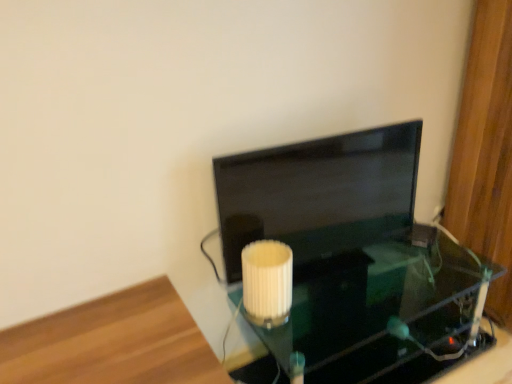
This screenshot has width=512, height=384. I want to click on blank space situated above wooden floor at lower left (from a real-world perspective), so click(x=105, y=350).